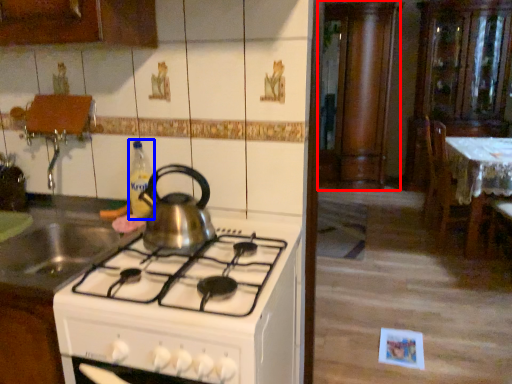
Question: Which object is further to the camera taking this photo, cabinetry (highlighted by a red box) or bottle (highlighted by a blue box)?

Choices:
 (A) cabinetry
 (B) bottle

Answer: (A)